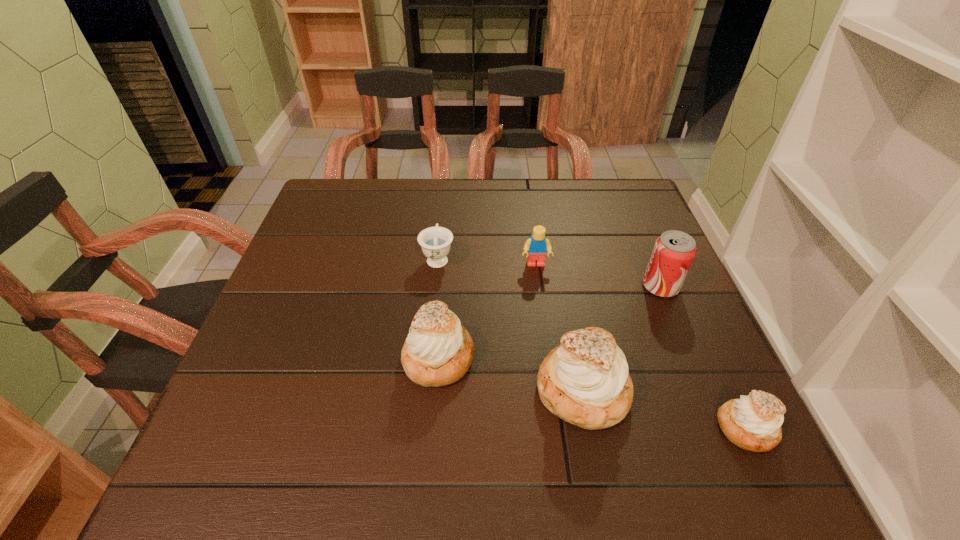
At what (x,y) coordinates should I click in order to perform the action: click on free spot between the third shortest object and the shortest pastry. Please return your answer as a coordinate pair (x, y). Looking at the image, I should click on (641, 347).

Locate which object is the second closest to the shortest pastry. Please provide its 2D coordinates. Your answer should be formatted as a tuple, i.e. [(x, y)], where the tuple contains the x and y coordinates of a point satisfying the conditions above.

[(674, 251)]

This screenshot has width=960, height=540. I want to click on object that is the third closest to the second pastry from right to left, so click(674, 251).

Locate which pastry is the second closest to the rightmost pastry. Please provide its 2D coordinates. Your answer should be formatted as a tuple, i.e. [(x, y)], where the tuple contains the x and y coordinates of a point satisfying the conditions above.

[(438, 351)]

Image resolution: width=960 pixels, height=540 pixels. Find the location of `pastry that is the second closest to the second shortest pastry`. pastry that is the second closest to the second shortest pastry is located at coordinates (753, 422).

You are a GUI agent. You are given a task and a screenshot of the screen. Output one action in this format:
    pyautogui.click(x=<x>, y=<y>)
    Task: Click on the vacant region that satisfies the following two spatial constraints: 1. on the front-facing side of the shortest pastry; 2. on the right side of the Lego
    The image size is (960, 540).
    Given the screenshot: What is the action you would take?
    pyautogui.click(x=558, y=428)

Find the location of a particular element. This screenshot has width=960, height=540. vacant space that satisfies the following two spatial constraints: 1. on the front-facing side of the Lego; 2. on the right side of the second pastry from left to right is located at coordinates (553, 390).

This screenshot has height=540, width=960. Identify the location of free space in the image that satisfies the following two spatial constraints: 1. on the front-facing side of the third shortest object; 2. on the left side of the shortest pastry. (558, 428).

Identify the location of free point that satisfies the following two spatial constraints: 1. on the front-facing side of the soda can; 2. on the left side of the Lego. (539, 286).

This screenshot has height=540, width=960. Find the location of `vacant area that satisfies the following two spatial constraints: 1. on the front-facing side of the rightmost pastry; 2. on the left side of the third shortest object`. vacant area that satisfies the following two spatial constraints: 1. on the front-facing side of the rightmost pastry; 2. on the left side of the third shortest object is located at coordinates (558, 428).